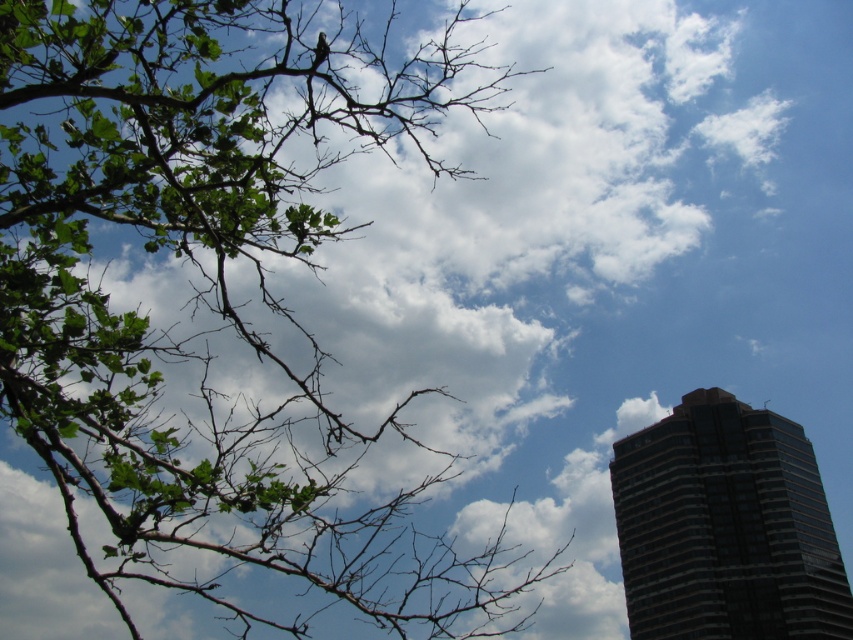
Question: Is green leafy branches at upper left behind dark glass building at right?

Choices:
 (A) yes
 (B) no

Answer: (B)

Question: Does green leafy branches at upper left have a greater width compared to dark glass building at right?

Choices:
 (A) no
 (B) yes

Answer: (A)

Question: Which point appears farthest from the camera in this image?

Choices:
 (A) (712, 540)
 (B) (396, 136)

Answer: (A)

Question: Is green leafy branches at upper left above dark glass building at right?

Choices:
 (A) no
 (B) yes

Answer: (B)

Question: Which object is closer to the camera taking this photo?

Choices:
 (A) green leafy branches at upper left
 (B) dark glass building at right

Answer: (A)

Question: Which point is farther to the camera?

Choices:
 (A) dark glass building at right
 (B) green leafy branches at upper left

Answer: (A)